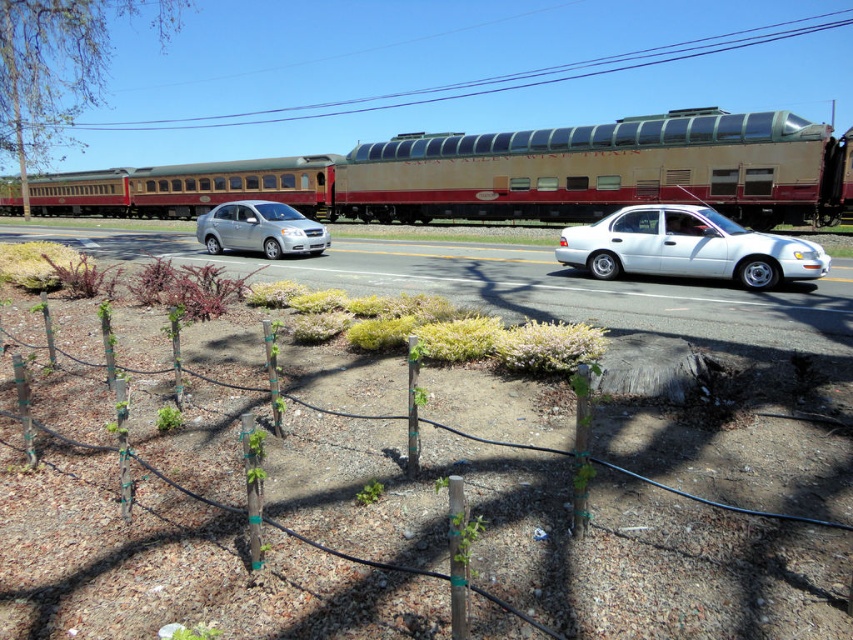
Question: Which of the following is the closest to the observer?

Choices:
 (A) green leafy tree at upper left
 (B) metallic gold train at center
 (C) green wood fence at lower center

Answer: (C)

Question: Is green wood fence at lower center in front of satin silver sedan at center?

Choices:
 (A) no
 (B) yes

Answer: (B)

Question: Which of these objects is positioned farthest from the white glossy sedan at right?

Choices:
 (A) metallic gold train at center
 (B) satin silver sedan at center

Answer: (A)

Question: Can you confirm if green leafy tree at upper left is bigger than white glossy sedan at right?

Choices:
 (A) yes
 (B) no

Answer: (A)

Question: In this image, where is green wood fence at lower center located relative to metallic gold train at center?

Choices:
 (A) above
 (B) below

Answer: (B)

Question: Among these objects, which one is farthest from the camera?

Choices:
 (A) satin silver sedan at center
 (B) green wood fence at lower center
 (C) metallic gold train at center
 (D) green leafy tree at upper left

Answer: (C)